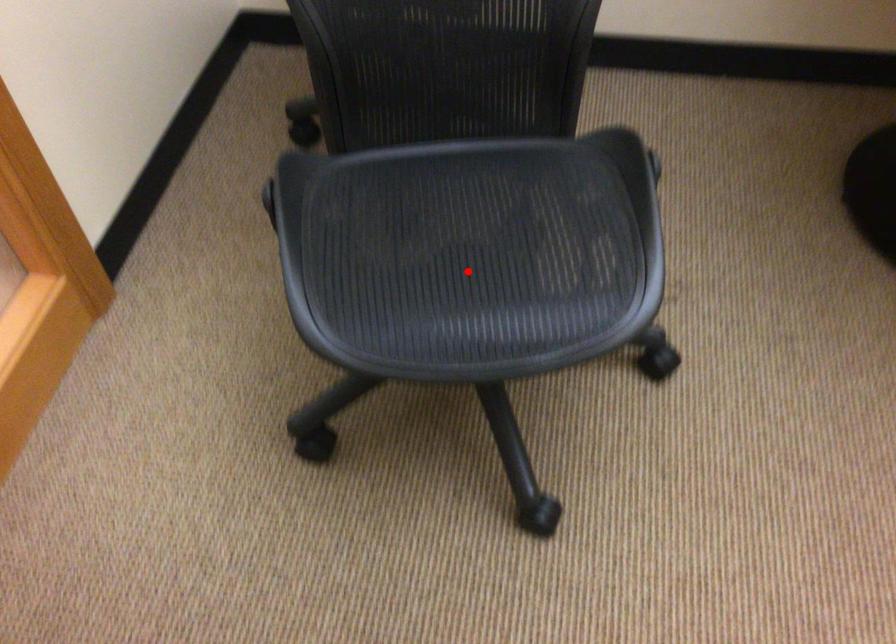
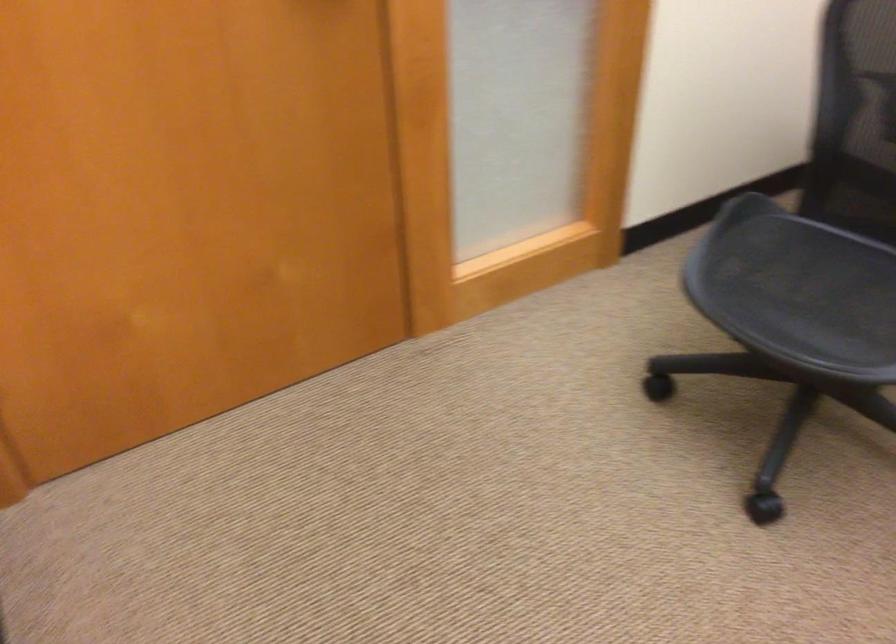
Question: A red point is marked in image1. In image2, is the corresponding 3D point closer to the camera or farther? Reply with the corresponding letter.

Choices:
 (A) The corresponding 3D point is closer.
 (B) The corresponding 3D point is farther.

Answer: (B)